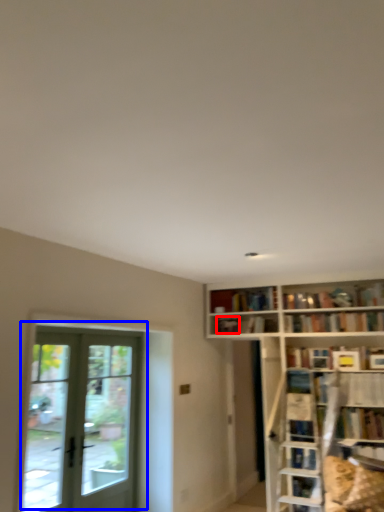
Question: Which object appears farthest to the camera in this image, book (highlighted by a red box) or door (highlighted by a blue box)?

Choices:
 (A) book
 (B) door

Answer: (A)